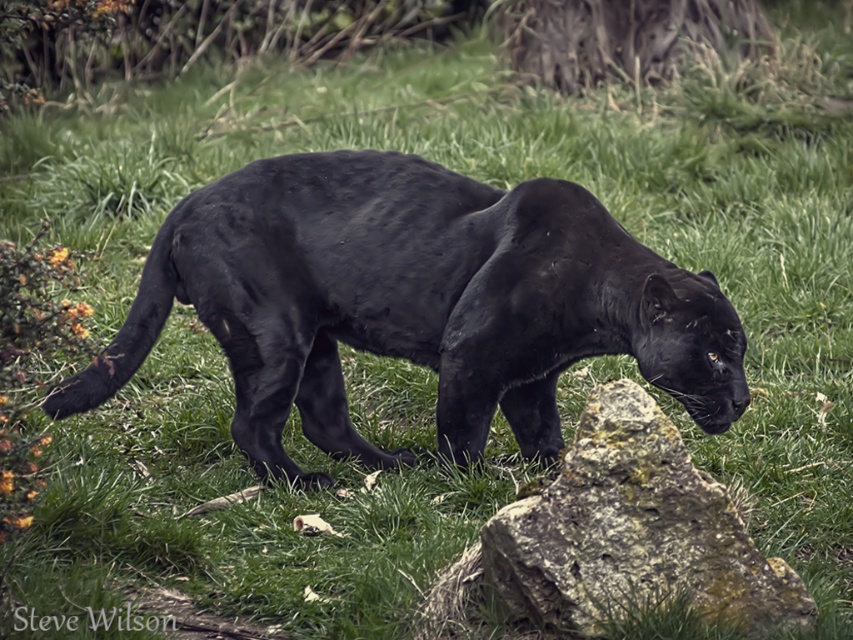
Consider the image. Can you confirm if matte black panther at center is positioned to the right of rough stone boulder at center?

In fact, matte black panther at center is to the left of rough stone boulder at center.

Which is more to the right, matte black panther at center or rough stone boulder at center?

From the viewer's perspective, rough stone boulder at center appears more on the right side.

What do you see at coordinates (416, 301) in the screenshot?
I see `matte black panther at center` at bounding box center [416, 301].

The height and width of the screenshot is (640, 853). What are the coordinates of `matte black panther at center` in the screenshot? It's located at (416, 301).